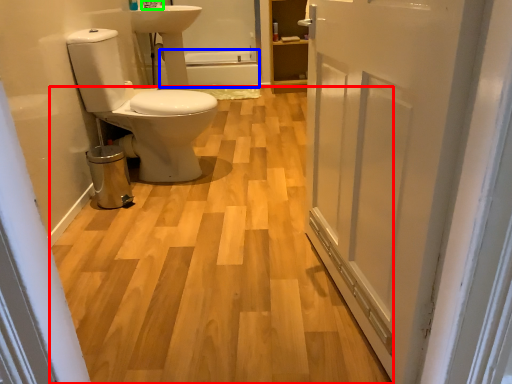
Question: Which is farther away from plain (highlighted by a red box)? bath (highlighted by a blue box) or tap (highlighted by a green box)?

Choices:
 (A) bath
 (B) tap

Answer: (A)